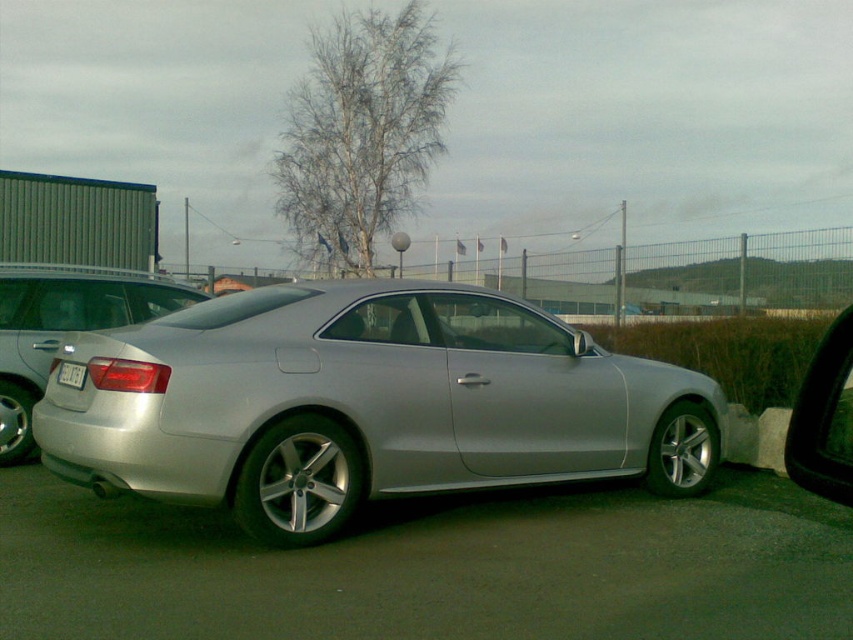
You are a delivery person trying to park your van next to the satin silver car at center and the black glossy view mirror at right. Considering their heights, which vehicle should you be cautious about hitting with your van when backing up?

The satin silver car at center is much taller than the black glossy view mirror at right, so you should be cautious about hitting the satin silver car at center with your van when backing up.

You are a photographer trying to capture the entire satin silver car at center and the white plastic license plate at rear in one shot. Considering their sizes, which object will appear bigger in your photo?

The satin silver car at center appears bigger in the photo because it has a larger size compared to the white plastic license plate at rear.

You are standing at the point marked as point [62,326] in the image. What object is located exactly at this point?

The satin silver car at center is located at point [62,326].